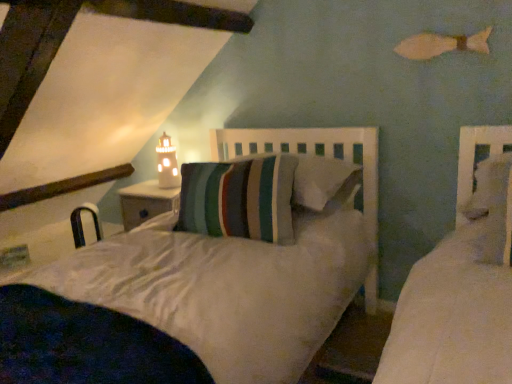
Question: From the image's perspective, is striped fabric pillow at center above white ceramic lighthouse at upper center?

Choices:
 (A) no
 (B) yes

Answer: (A)

Question: Is striped fabric pillow at center to the right of white ceramic lighthouse at upper center from the viewer's perspective?

Choices:
 (A) yes
 (B) no

Answer: (A)

Question: From the image's perspective, is striped fabric pillow at center below white ceramic lighthouse at upper center?

Choices:
 (A) yes
 (B) no

Answer: (A)

Question: Is striped fabric pillow at center smaller than white ceramic lighthouse at upper center?

Choices:
 (A) no
 (B) yes

Answer: (A)

Question: Is striped fabric pillow at center bigger than white ceramic lighthouse at upper center?

Choices:
 (A) no
 (B) yes

Answer: (B)

Question: From the image's perspective, relative to striped fabric pillow at center, is white ceramic lighthouse at upper center above or below?

Choices:
 (A) above
 (B) below

Answer: (A)

Question: In the image, is white ceramic lighthouse at upper center on the left side or the right side of striped fabric pillow at center?

Choices:
 (A) right
 (B) left

Answer: (B)

Question: Choose the correct answer: Is white ceramic lighthouse at upper center inside striped fabric pillow at center or outside it?

Choices:
 (A) outside
 (B) inside

Answer: (A)

Question: Based on their sizes in the image, would you say white ceramic lighthouse at upper center is bigger or smaller than striped fabric pillow at center?

Choices:
 (A) big
 (B) small

Answer: (B)

Question: Based on their sizes in the image, would you say striped fabric pillow at center is bigger or smaller than metallic silver chair at lower left?

Choices:
 (A) small
 (B) big

Answer: (B)

Question: In the image, is striped fabric pillow at center on the left side or the right side of metallic silver chair at lower left?

Choices:
 (A) right
 (B) left

Answer: (A)

Question: Considering the positions of striped fabric pillow at center and metallic silver chair at lower left in the image, is striped fabric pillow at center wider or thinner than metallic silver chair at lower left?

Choices:
 (A) thin
 (B) wide

Answer: (B)

Question: From a real-world perspective, is striped fabric pillow at center positioned above or below metallic silver chair at lower left?

Choices:
 (A) above
 (B) below

Answer: (A)

Question: Considering the positions of white ceramic lighthouse at upper center and metallic silver chair at lower left in the image, is white ceramic lighthouse at upper center bigger or smaller than metallic silver chair at lower left?

Choices:
 (A) big
 (B) small

Answer: (B)

Question: Relative to metallic silver chair at lower left, is white ceramic lighthouse at upper center in front or behind?

Choices:
 (A) front
 (B) behind

Answer: (A)